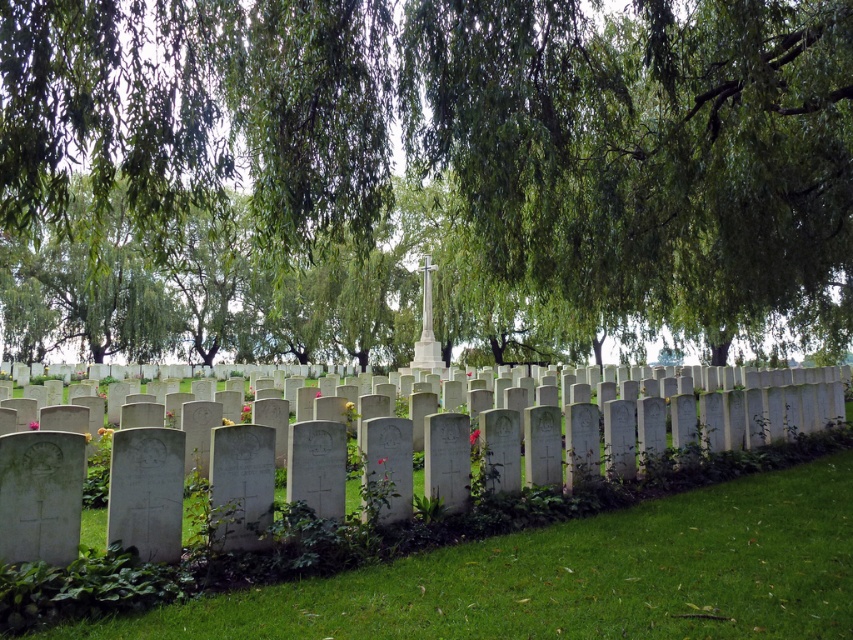
Locate an element on the screen. The width and height of the screenshot is (853, 640). green leafy tree at center is located at coordinates (422, 173).

Is green leafy tree at center positioned in front of green grass at lower center?

No, it is behind green grass at lower center.

Is point (601, 140) less distant than point (831, 499)?

No.

Find the location of a particular element. green leafy tree at center is located at coordinates (422, 173).